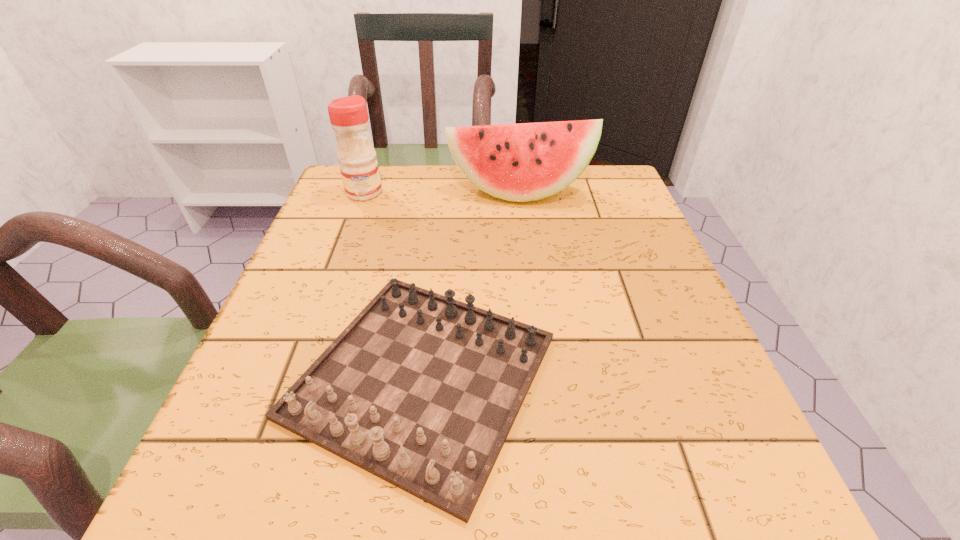
Where is `object that is the nearest to the nearest object`? object that is the nearest to the nearest object is located at coordinates (523, 162).

Image resolution: width=960 pixels, height=540 pixels. What are the coordinates of `object that is the second closest to the condiment` in the screenshot? It's located at (421, 390).